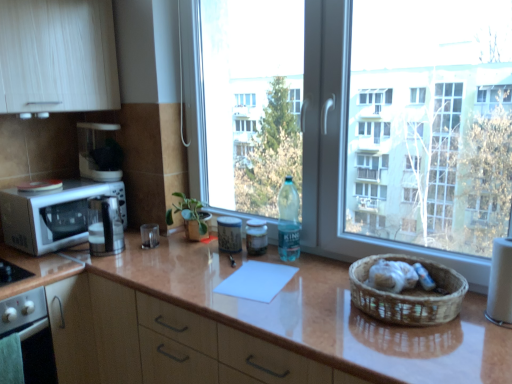
Find the location of `free space to the left of matte glass jar at center, the 3th appliance positioned from the bottom`. free space to the left of matte glass jar at center, the 3th appliance positioned from the bottom is located at coordinates (192, 254).